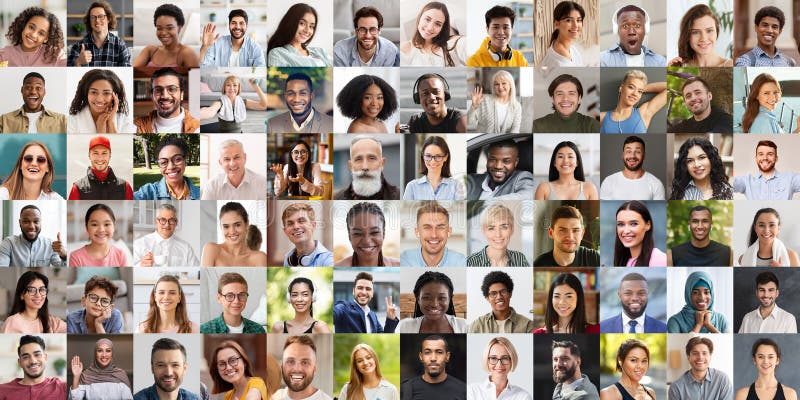
Where is `headphones or earbuds in picture`? headphones or earbuds in picture is located at coordinates [x=494, y=28], [x=630, y=108], [x=432, y=101], [x=290, y=225], [x=626, y=360].